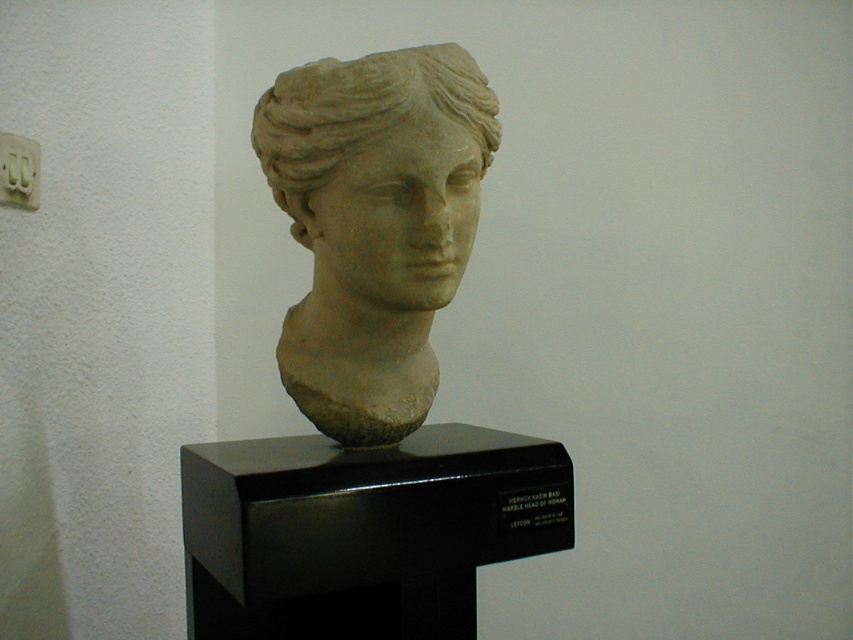
You are a photographer standing in front of the matte stone bust at center. Your camera is set to a focal length of 50mm. To capture the entire bust in the frame, you need to be at least 1.2 meters away. Are you positioned correctly?

The matte stone bust at center and camera are 1.19 meters apart. Since 1.19 meters is less than the required 1.2 meters, you are too close to capture the entire bust in the frame at a 50mm focal length.

From the picture: You are standing in front of a classical marble bust displayed on a black pedestal in a museum. You have a measuring tool that can measure distances up to 1.5 meters. There is a point labeled as point (309,150) in the scene. Can your measuring tool reach that point?

The point (309,150) is 1.22 meters away from the camera, so yes, the measuring tool can reach it since its maximum range of 1.5 meters is greater than the distance to the point.

You are an art conservator assessing the dimensions of two sculptures in a museum. You see the matte stone bust at center and the white marble head at center. Which sculpture has a greater width?

The white marble head at center has a greater width than the matte stone bust at center.